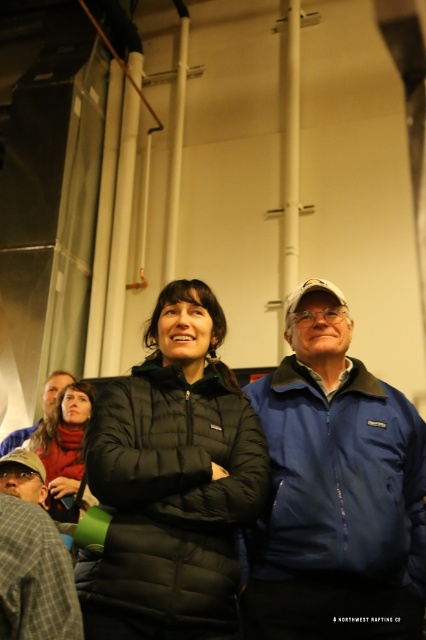
Question: Which of the following is the closest to the observer?

Choices:
 (A) matte black jacket at center
 (B) matte black jacket at lower left

Answer: (A)

Question: Is blue fleece jacket at center smaller than black puffer jacket at center?

Choices:
 (A) yes
 (B) no

Answer: (B)

Question: Observing the image, what is the correct spatial positioning of plaid wool jacket at lower left in reference to matte black jacket at center?

Choices:
 (A) left
 (B) right

Answer: (B)

Question: Which point is closer to the camera taking this photo?

Choices:
 (A) (74, 502)
 (B) (65, 380)
 (C) (331, 401)

Answer: (C)

Question: Can you confirm if matte black jacket at center is smaller than matte black jacket at lower left?

Choices:
 (A) no
 (B) yes

Answer: (A)

Question: Estimate the real-world distances between objects in this image. Which object is closer to the black puffer jacket at center?

Choices:
 (A) blue fleece jacket at center
 (B) plaid wool jacket at lower left
 (C) matte black jacket at center

Answer: (B)